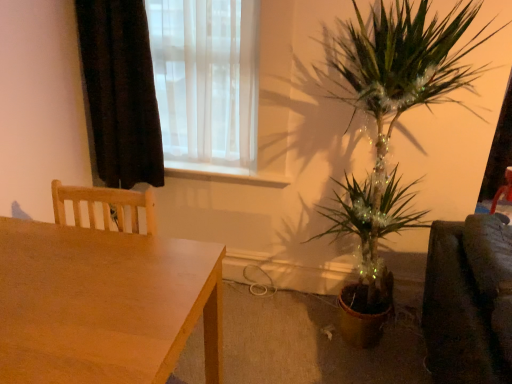
Question: Considering the positions of point (138, 142) and point (163, 79), is point (138, 142) closer or farther from the camera than point (163, 79)?

Choices:
 (A) farther
 (B) closer

Answer: (A)

Question: In terms of size, does black velvet curtain at upper left appear bigger or smaller than translucent white curtain at upper left?

Choices:
 (A) big
 (B) small

Answer: (B)

Question: Which is nearer to the translucent white curtain at upper left?

Choices:
 (A) white glossy window sill at center
 (B) black velvet curtain at upper left
 (C) wooden table at lower left

Answer: (B)

Question: Which of these objects is positioned closest to the white glossy window sill at center?

Choices:
 (A) translucent white curtain at upper left
 (B) wooden table at lower left
 (C) black velvet curtain at upper left

Answer: (A)